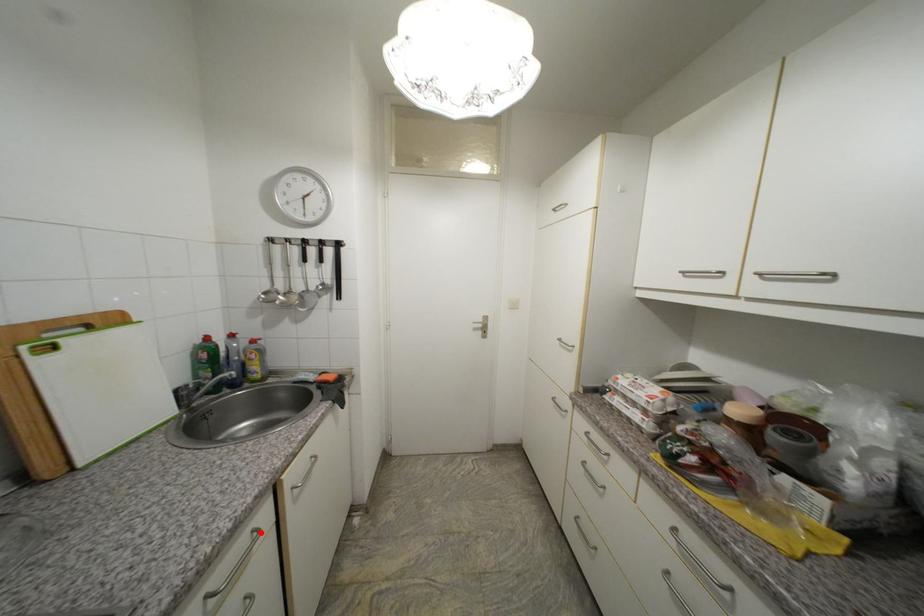
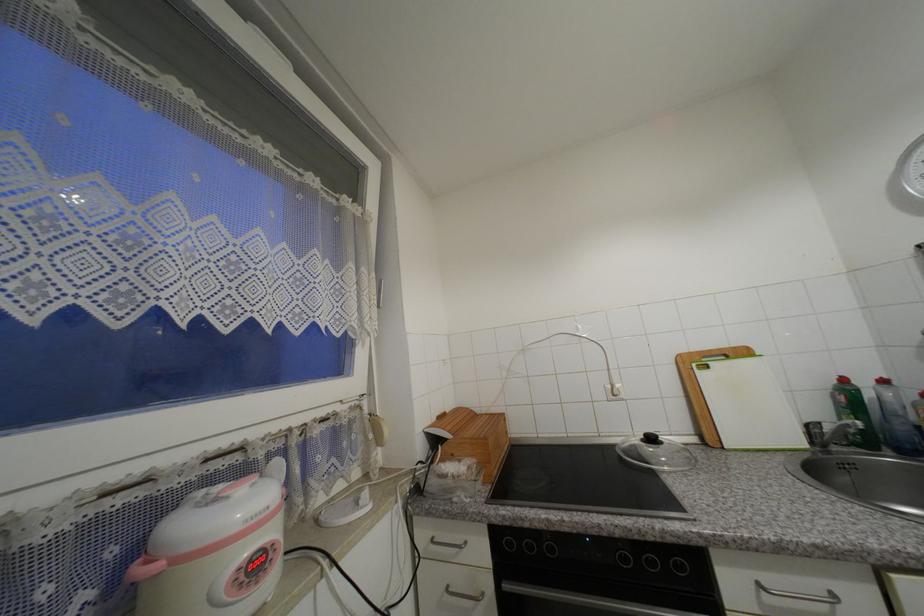
Question: I am providing you with two images of the same scene from different viewpoints. In image1, a red point is highlighted. Considering the same 3D point in image2, which of the following is correct?

Choices:
 (A) It is closer
 (B) It is farther

Answer: (A)